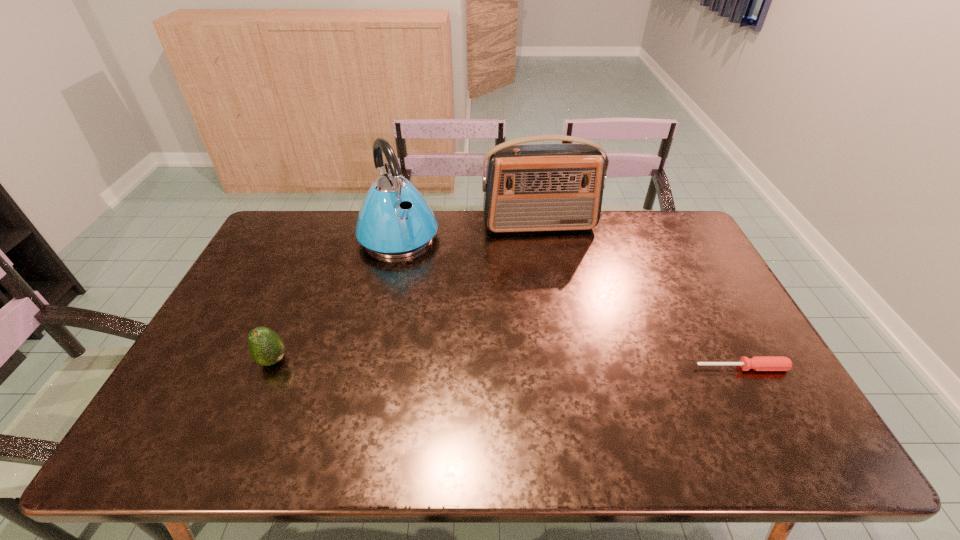
Image resolution: width=960 pixels, height=540 pixels. I want to click on vacant space located on the front-facing side of the radio receiver, so click(548, 249).

Locate an element on the screen. free space located at the spout of the kettle is located at coordinates (463, 328).

At what (x,y) coordinates should I click in order to perform the action: click on free point located 0.110m at the spout of the kettle. Please return your answer as a coordinate pair (x, y). This screenshot has width=960, height=540. Looking at the image, I should click on (427, 279).

This screenshot has height=540, width=960. Find the location of `vacant area situated at the spout of the kettle`. vacant area situated at the spout of the kettle is located at coordinates (450, 310).

Image resolution: width=960 pixels, height=540 pixels. Identify the location of radio receiver that is at the far edge. (534, 187).

I want to click on kettle present at the far edge, so (395, 221).

Identify the location of object situated at the right edge. The image size is (960, 540). tap(758, 363).

Find the location of a particular element. This screenshot has width=960, height=540. vacant space at the far edge of the desktop is located at coordinates (533, 248).

In the image, there is a desktop. Identify the location of vacant space at the left edge. The image size is (960, 540). (271, 293).

Where is `free space at the far right corner of the desktop`? free space at the far right corner of the desktop is located at coordinates (678, 215).